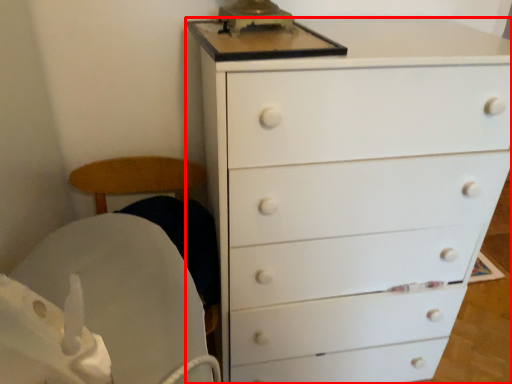
Question: In this image, where is chest of drawers (annotated by the red box) located relative to rocking chair?

Choices:
 (A) right
 (B) left

Answer: (A)